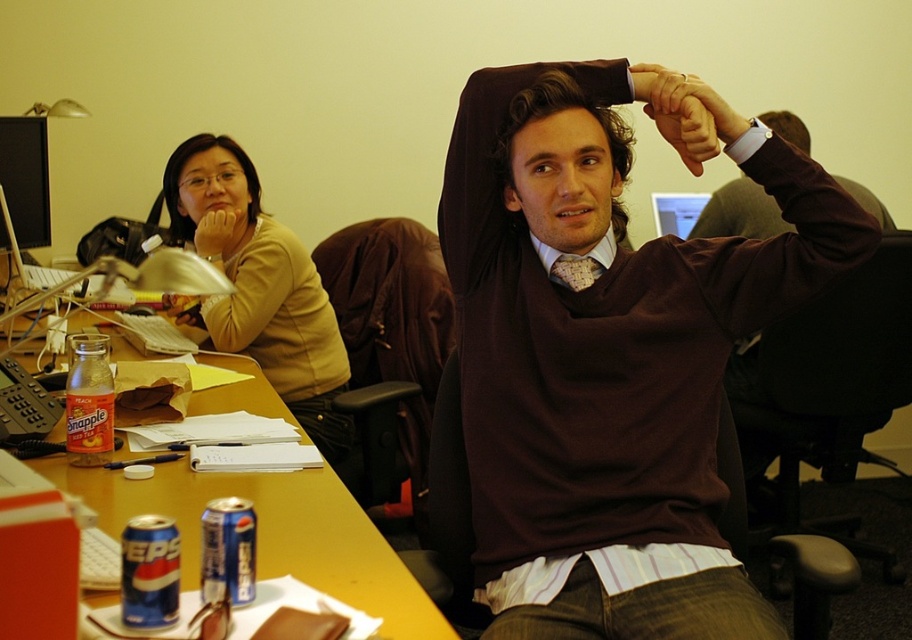
Does point (520, 97) lie behind point (167, 198)?

That is False.

How distant is matte brown hair at center from matte yellow shirt at upper left?

They are 1.21 meters apart.

Between point (587, 106) and point (179, 182), which one is positioned in front?

Point (587, 106)

Identify the location of matte brown hair at center. The width and height of the screenshot is (912, 640). pyautogui.click(x=558, y=113).

Can you confirm if yellow wood desk at center is thinner than matte yellow shirt at upper left?

No.

Does yellow wood desk at center appear on the right side of matte yellow shirt at upper left?

Correct, you'll find yellow wood desk at center to the right of matte yellow shirt at upper left.

Is point (219, 289) positioned in front of point (177, 154)?

Yes, it is in front of point (177, 154).

At what (x,y) coordinates should I click in order to perform the action: click on yellow wood desk at center. Please return your answer as a coordinate pair (x, y). Looking at the image, I should click on (276, 532).

Between matte brown sweater at upper right and matte black hand at upper center, which one is positioned lower?

matte brown sweater at upper right is lower down.

Is point (710, 467) positioned before point (680, 134)?

No.

Where is `matte brown sweater at upper right`? matte brown sweater at upper right is located at coordinates (609, 356).